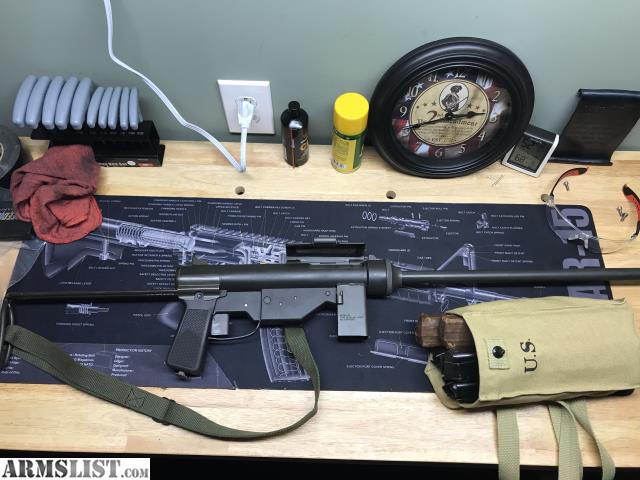
You are a GUI agent. You are given a task and a screenshot of the screen. Output one action in this format:
    pyautogui.click(x=<x>, y=<y>)
    Task: Click on the electric outlet
    
    Given the screenshot: What is the action you would take?
    pyautogui.click(x=264, y=97)